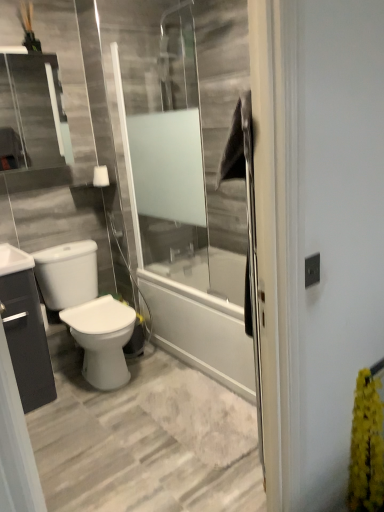
Question: Is matte black cabinet at left inside white glossy toilet at lower left?

Choices:
 (A) no
 (B) yes

Answer: (A)

Question: Is white glossy toilet at lower left looking in the opposite direction of matte black cabinet at left?

Choices:
 (A) no
 (B) yes

Answer: (A)

Question: From a real-world perspective, is white glossy toilet at lower left over matte black cabinet at left?

Choices:
 (A) yes
 (B) no

Answer: (A)

Question: Is white glossy toilet at lower left at the left side of matte black cabinet at left?

Choices:
 (A) yes
 (B) no

Answer: (B)

Question: Would you consider white glossy toilet at lower left to be distant from matte black cabinet at left?

Choices:
 (A) yes
 (B) no

Answer: (B)

Question: Is white glossy toilet at lower left further to camera compared to matte black cabinet at left?

Choices:
 (A) no
 (B) yes

Answer: (B)

Question: From a real-world perspective, does matte black cabinet at left stand above yellow fluffy plant at right?

Choices:
 (A) no
 (B) yes

Answer: (B)

Question: Would you say matte black cabinet at left is outside yellow fluffy plant at right?

Choices:
 (A) no
 (B) yes

Answer: (B)

Question: Does matte black cabinet at left come in front of yellow fluffy plant at right?

Choices:
 (A) no
 (B) yes

Answer: (A)

Question: Can you confirm if matte black cabinet at left is positioned to the left of yellow fluffy plant at right?

Choices:
 (A) no
 (B) yes

Answer: (B)

Question: Is yellow fluffy plant at right located within matte black cabinet at left?

Choices:
 (A) no
 (B) yes

Answer: (A)

Question: Considering the relative sizes of matte black cabinet at left and yellow fluffy plant at right in the image provided, is matte black cabinet at left thinner than yellow fluffy plant at right?

Choices:
 (A) no
 (B) yes

Answer: (A)

Question: Is yellow fluffy plant at right thinner than matte black cabinet at left?

Choices:
 (A) yes
 (B) no

Answer: (A)